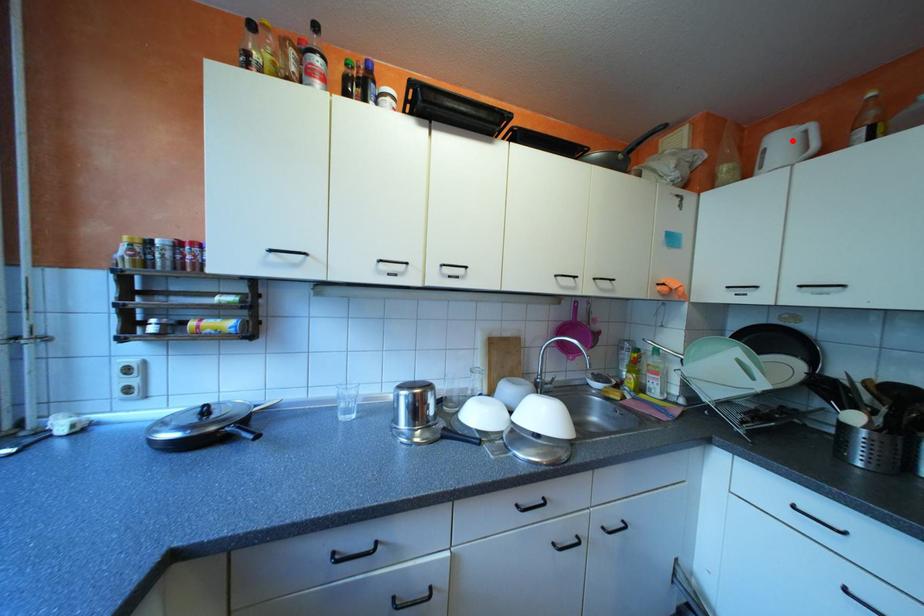
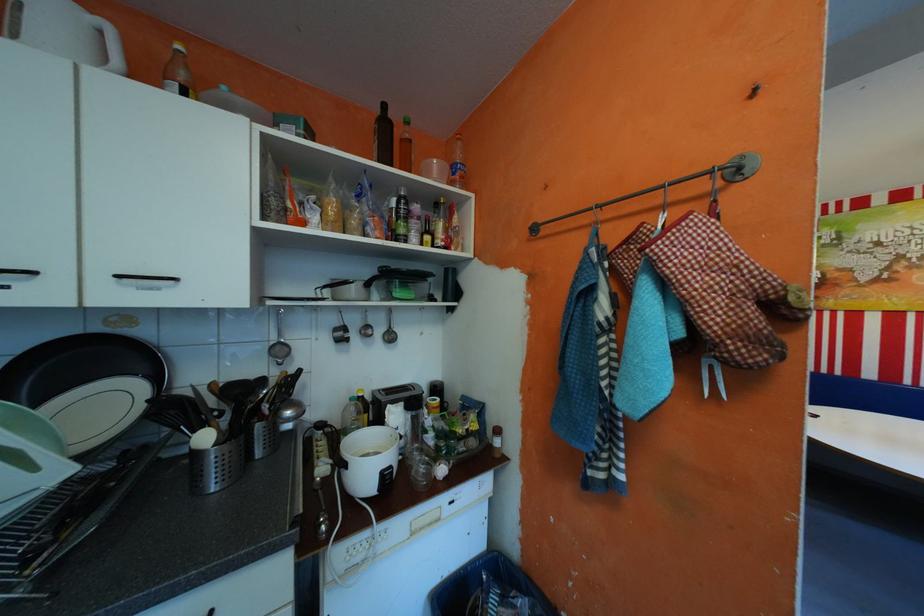
The point at the highlighted location is marked in the first image. Where is the corresponding point in the second image?

(66, 12)